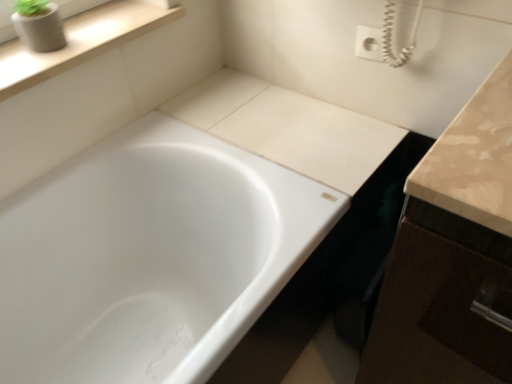
Question: Are matte gray concrete planter at upper left and wooden at upper left making contact?

Choices:
 (A) no
 (B) yes

Answer: (A)

Question: Is matte gray concrete planter at upper left closer to the viewer compared to wooden at upper left?

Choices:
 (A) no
 (B) yes

Answer: (A)

Question: From the image's perspective, would you say matte gray concrete planter at upper left is positioned over wooden at upper left?

Choices:
 (A) no
 (B) yes

Answer: (B)

Question: Can wooden at upper left be found inside matte gray concrete planter at upper left?

Choices:
 (A) yes
 (B) no

Answer: (B)

Question: Is matte gray concrete planter at upper left turned away from wooden at upper left?

Choices:
 (A) no
 (B) yes

Answer: (A)

Question: Is white glossy bathtub at center wider or thinner than matte gray concrete planter at upper left?

Choices:
 (A) thin
 (B) wide

Answer: (B)

Question: Is white glossy bathtub at center situated inside matte gray concrete planter at upper left or outside?

Choices:
 (A) inside
 (B) outside

Answer: (B)

Question: Relative to matte gray concrete planter at upper left, is white glossy bathtub at center in front or behind?

Choices:
 (A) front
 (B) behind

Answer: (A)

Question: From the image's perspective, is white glossy bathtub at center positioned above or below matte gray concrete planter at upper left?

Choices:
 (A) below
 (B) above

Answer: (A)

Question: Relative to matte gray concrete planter at upper left, is wooden at upper left in front or behind?

Choices:
 (A) front
 (B) behind

Answer: (A)

Question: Is wooden at upper left wider or thinner than matte gray concrete planter at upper left?

Choices:
 (A) thin
 (B) wide

Answer: (B)

Question: From the image's perspective, is wooden at upper left positioned above or below matte gray concrete planter at upper left?

Choices:
 (A) below
 (B) above

Answer: (A)

Question: From a real-world perspective, is wooden at upper left positioned above or below matte gray concrete planter at upper left?

Choices:
 (A) below
 (B) above

Answer: (A)

Question: From the image's perspective, is matte gray concrete planter at upper left positioned above or below white glossy bathtub at center?

Choices:
 (A) above
 (B) below

Answer: (A)

Question: Is point (66, 11) positioned closer to the camera than point (278, 264)?

Choices:
 (A) closer
 (B) farther

Answer: (B)